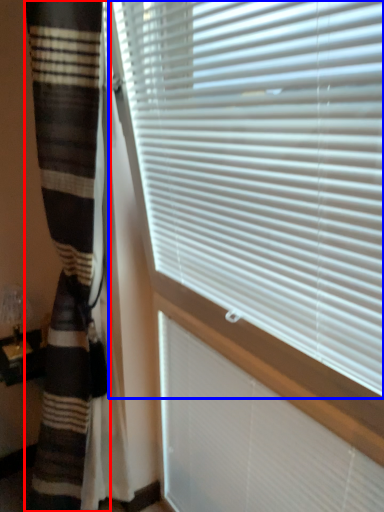
Question: Which object appears farthest to the camera in this image, curtain (highlighted by a red box) or window blind (highlighted by a blue box)?

Choices:
 (A) curtain
 (B) window blind

Answer: (A)